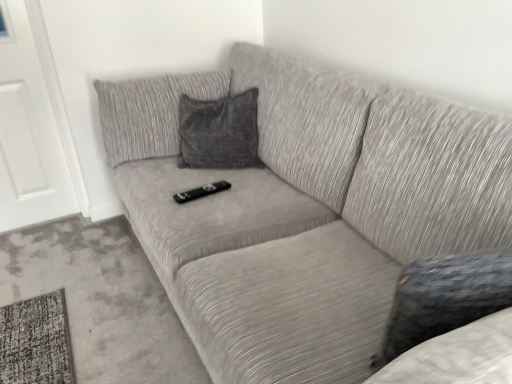
Locate an element on the screen. Image resolution: width=512 pixels, height=384 pixels. white matte door at left is located at coordinates (33, 125).

The height and width of the screenshot is (384, 512). I want to click on textured gray couch at center, so click(304, 209).

The width and height of the screenshot is (512, 384). In order to click on white matte door at left in this screenshot , I will do `click(33, 125)`.

From the image's perspective, between textured gray couch at center and black plastic remote at center, which one is located above?

From the image's view, black plastic remote at center is above.

From a real-world perspective, is textured gray couch at center above or below black plastic remote at center?

In terms of real-world spatial position, textured gray couch at center is below black plastic remote at center.

Between textured gray couch at center and black plastic remote at center, which one has larger width?

With larger width is textured gray couch at center.

From a real-world perspective, is black plastic remote at center located higher than white matte door at left?

No, from a real-world perspective, black plastic remote at center is not above white matte door at left.

You are a GUI agent. You are given a task and a screenshot of the screen. Output one action in this format:
    pyautogui.click(x=<x>, y=<y>)
    Task: Click on the remote located on the right of white matte door at left
    The image size is (512, 384).
    Given the screenshot: What is the action you would take?
    pyautogui.click(x=201, y=191)

Considering the relative positions of black plastic remote at center and white matte door at left in the image provided, is black plastic remote at center to the right of white matte door at left from the viewer's perspective?

Correct, you'll find black plastic remote at center to the right of white matte door at left.

How many degrees apart are the facing directions of black plastic remote at center and white matte door at left?

The angle between the facing direction of black plastic remote at center and the facing direction of white matte door at left is 75.7 degrees.

Is textured gray couch at center oriented away from white matte door at left?

No, textured gray couch at center's orientation is not away from white matte door at left.

In order to click on studio couch in front of the white matte door at left in this screenshot , I will do `click(304, 209)`.

Does point (270, 168) come closer to viewer compared to point (12, 26)?

That is True.

Can you confirm if textured gray couch at center is shorter than white matte door at left?

Yes.

From the image's perspective, is black plastic remote at center above or below textured gray couch at center?

black plastic remote at center is situated higher than textured gray couch at center in the image.

Measure the distance from black plastic remote at center to textured gray couch at center.

black plastic remote at center is 17.85 inches from textured gray couch at center.

Which of these two, black plastic remote at center or textured gray couch at center, is wider?

textured gray couch at center is wider.

Is black plastic remote at center bigger than textured gray couch at center?

Incorrect, black plastic remote at center is not larger than textured gray couch at center.

From the image's perspective, is white matte door at left above or below black plastic remote at center?

From the image's perspective, white matte door at left appears above black plastic remote at center.

Is white matte door at left far away from black plastic remote at center?

Yes, white matte door at left and black plastic remote at center are quite far apart.

Based on the photo, could you tell me if white matte door at left is turned towards black plastic remote at center?

No, white matte door at left is not turned towards black plastic remote at center.

From a real-world perspective, is white matte door at left above or below textured gray couch at center?

From a real-world perspective, white matte door at left is physically above textured gray couch at center.

Between white matte door at left and textured gray couch at center, which one has less height?

Standing shorter between the two is textured gray couch at center.

Choose the correct answer: Is white matte door at left inside textured gray couch at center or outside it?

The correct answer is: outside.

Can you tell me how much white matte door at left and textured gray couch at center differ in facing direction?

They differ by 89.4 degrees in their facing directions.

Locate an element on the screen. The height and width of the screenshot is (384, 512). studio couch located underneath the black plastic remote at center (from a real-world perspective) is located at coordinates (304, 209).

Where is `door behind the black plastic remote at center`? This screenshot has height=384, width=512. door behind the black plastic remote at center is located at coordinates (33, 125).

Looking at the image, which one is located further to black plastic remote at center, textured gray couch at center or white matte door at left?

white matte door at left.

Estimate the real-world distances between objects in this image. Which object is further from textured gray couch at center, white matte door at left or black plastic remote at center?

white matte door at left lies further to textured gray couch at center than the other object.

Which object lies nearer to the anchor point white matte door at left, textured gray couch at center or black plastic remote at center?

textured gray couch at center is positioned closer to the anchor white matte door at left.

Considering their positions, is black plastic remote at center positioned closer to white matte door at left than textured gray couch at center?

The object closer to white matte door at left is textured gray couch at center.

Based on their spatial positions, is white matte door at left or textured gray couch at center closer to black plastic remote at center?

The object closer to black plastic remote at center is textured gray couch at center.

Considering their positions, is black plastic remote at center positioned further to textured gray couch at center than white matte door at left?

white matte door at left is further to textured gray couch at center.

This screenshot has height=384, width=512. Identify the location of remote between textured gray couch at center and white matte door at left from front to back. (201, 191).